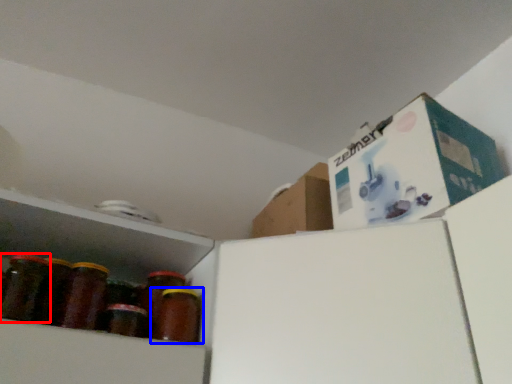
Question: Among these objects, which one is nearest to the camera, bottle (highlighted by a red box) or bottle (highlighted by a blue box)?

Choices:
 (A) bottle
 (B) bottle

Answer: (A)